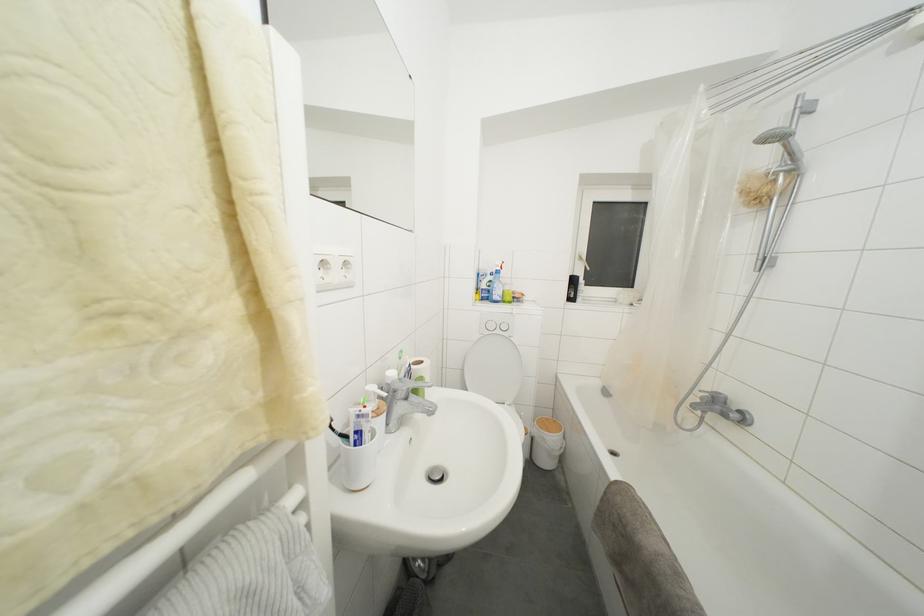
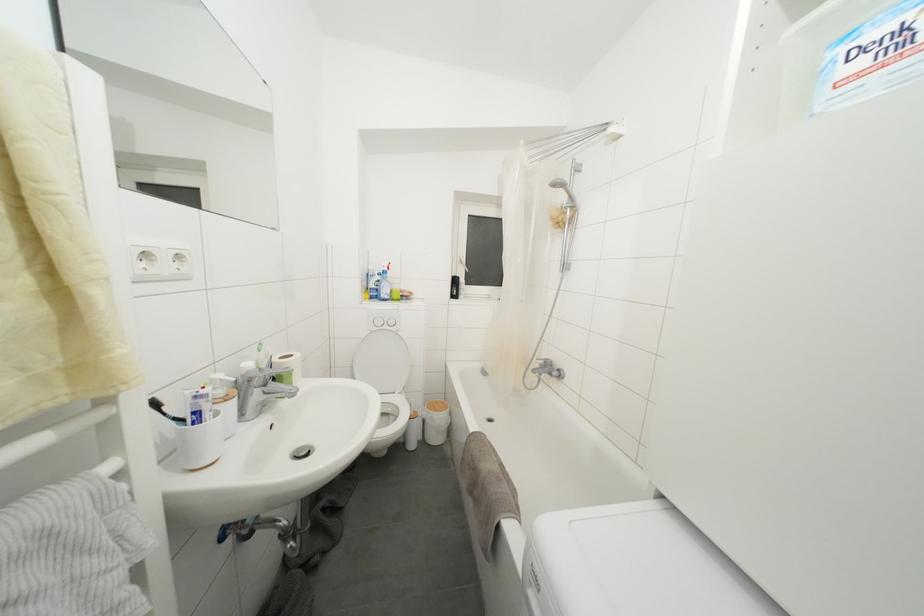
Locate, in the second image, the point that corresponds to [490,301] in the first image.

(379, 300)